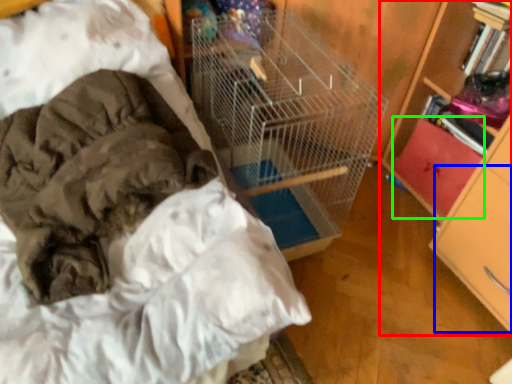
Question: Estimate the real-world distances between objects in this image. Which object is farther from bookcase (highlighted by a red box), drawer (highlighted by a blue box) or drawer (highlighted by a green box)?

Choices:
 (A) drawer
 (B) drawer

Answer: (B)